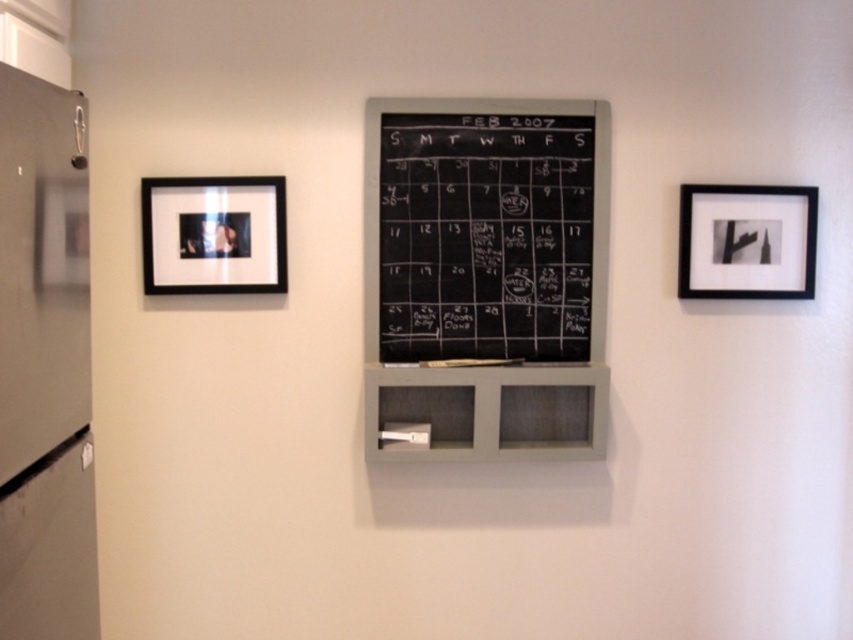
You are standing in front of the wall and want to hang a new picture between the black chalkboard at center and the metallic refrigerator at left. Which object should you place the picture closer to if you want it to be closer to the wider object?

The black chalkboard at center might be wider than metallic refrigerator at left, so placing the picture closer to the black chalkboard at center would position it nearer to the wider object.